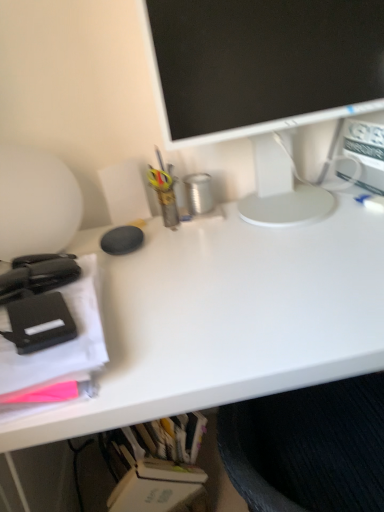
Question: Considering the relative sizes of black matte stapler at left, which ranks as the first office supplies in back-to-front order, and white matte desk at center in the image provided, is black matte stapler at left, which ranks as the first office supplies in back-to-front order, bigger than white matte desk at center?

Choices:
 (A) yes
 (B) no

Answer: (B)

Question: Is black matte stapler at left, which ranks as the first office supplies in back-to-front order, not inside white matte desk at center?

Choices:
 (A) no
 (B) yes

Answer: (B)

Question: Is white matte desk at center located within black matte stapler at left, which ranks as the first office supplies in back-to-front order?

Choices:
 (A) no
 (B) yes

Answer: (A)

Question: Is black matte stapler at left, which ranks as the first office supplies in back-to-front order, further to the viewer compared to white matte desk at center?

Choices:
 (A) yes
 (B) no

Answer: (A)

Question: Does black matte stapler at left, which appears as the second office supplies when viewed from the front, touch white matte desk at center?

Choices:
 (A) yes
 (B) no

Answer: (B)

Question: Can you confirm if black matte stapler at left, which ranks as the first office supplies in back-to-front order, is thinner than white matte desk at center?

Choices:
 (A) yes
 (B) no

Answer: (A)

Question: Would you say white matte desk at center is part of matte black stapler at left, which appears as the 2th office supplies when viewed from the back,'s contents?

Choices:
 (A) yes
 (B) no

Answer: (B)

Question: Is matte black stapler at left, arranged as the first office supplies when viewed from the front, aimed at white matte desk at center?

Choices:
 (A) no
 (B) yes

Answer: (A)

Question: Can you confirm if matte black stapler at left, arranged as the first office supplies when viewed from the front, is positioned to the left of white matte desk at center?

Choices:
 (A) yes
 (B) no

Answer: (A)

Question: Can you confirm if matte black stapler at left, which appears as the 2th office supplies when viewed from the back, is positioned to the right of white matte desk at center?

Choices:
 (A) yes
 (B) no

Answer: (B)

Question: Is matte black stapler at left, which appears as the 2th office supplies when viewed from the back, behind white matte desk at center?

Choices:
 (A) no
 (B) yes

Answer: (A)

Question: Can you confirm if matte black stapler at left, which appears as the 2th office supplies when viewed from the back, is thinner than white matte desk at center?

Choices:
 (A) yes
 (B) no

Answer: (A)

Question: Are matte black stapler at left, arranged as the first office supplies when viewed from the front, and white glossy monitor at upper center far apart?

Choices:
 (A) yes
 (B) no

Answer: (B)